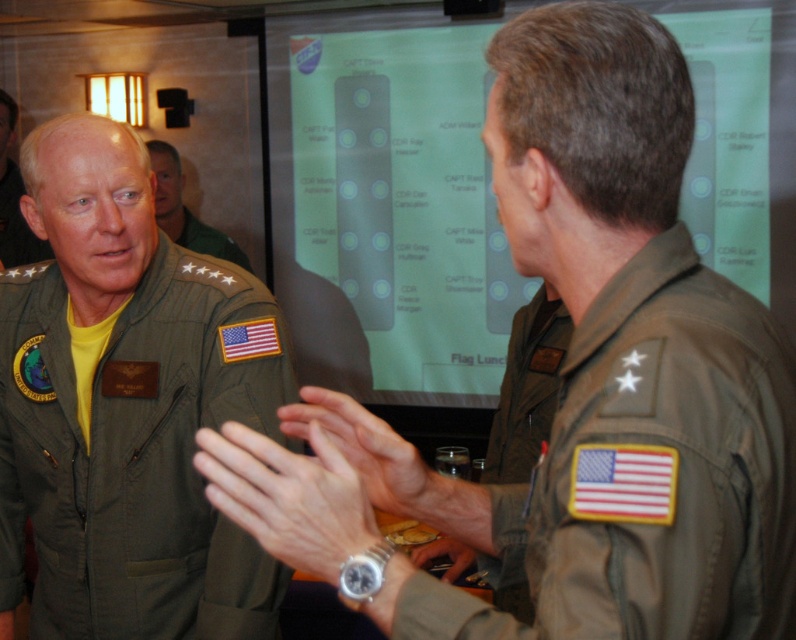
Between matte green uniform at center and green uniform at center, which one appears on the right side from the viewer's perspective?

matte green uniform at center is more to the right.

Measure the distance between point [393,461] and camera.

A distance of 1.03 meters exists between point [393,461] and camera.

The width and height of the screenshot is (796, 640). What are the coordinates of `matte green uniform at center` in the screenshot? It's located at (365, 449).

Can you confirm if matte green uniform at center is thinner than metallic wristwatch at center?

Incorrect, matte green uniform at center's width is not less than metallic wristwatch at center's.

Who is more forward, (404,449) or (436,560)?

Point (404,449)

Find the location of a particular element. The width and height of the screenshot is (796, 640). matte green uniform at center is located at coordinates (365, 449).

Between green fabric uniform at center and matte green uniform at center, which one appears on the left side from the viewer's perspective?

Positioned to the left is green fabric uniform at center.

Who is more distant from viewer, (244, 381) or (341, 432)?

Positioned behind is point (244, 381).

Describe the element at coordinates (135, 452) in the screenshot. I see `green fabric uniform at center` at that location.

I want to click on green fabric uniform at center, so click(x=135, y=452).